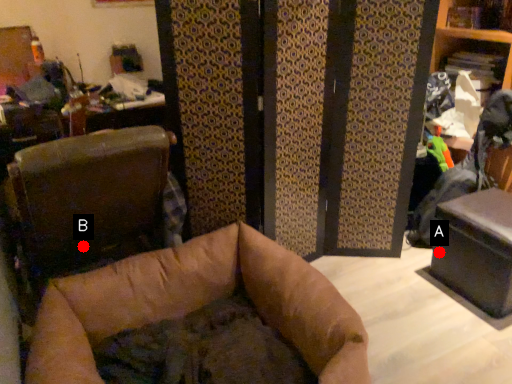
Question: Two points are circled on the image, labeled by A and B beside each circle. Among these points, which one is farthest from the camera?

Choices:
 (A) A is further
 (B) B is further

Answer: (A)